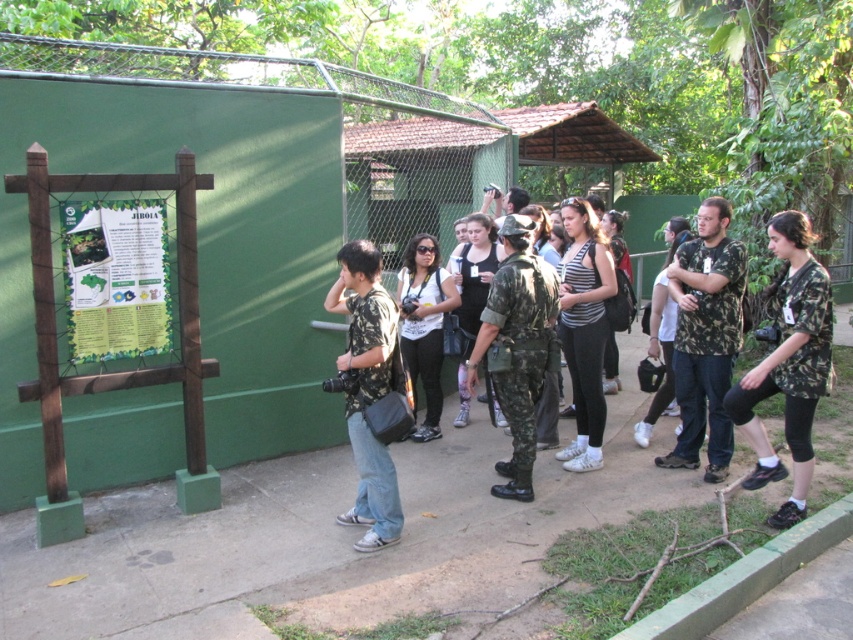
You are a photographer trying to capture both the camouflage uniform at center and the striped fabric shirt at center in a single frame. Based on their positions, which clothing item is more likely to fit entirely within the camera frame if you focus on the center of the scene?

The camouflage uniform at center is wider than the striped fabric shirt at center, so focusing on the center would allow the camouflage uniform at center to fit entirely within the frame more easily than the striped fabric shirt at center.